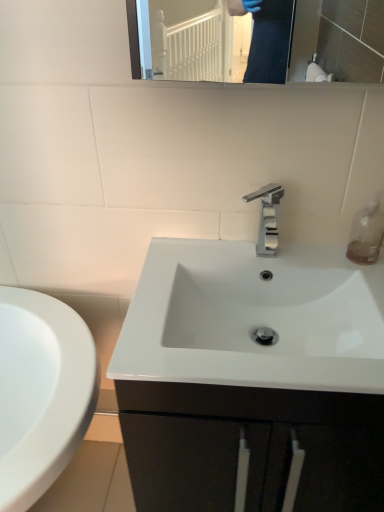
Find the location of a particular element. free space between polished chrome faucet at center and transparent plastic soap dispenser at upper right is located at coordinates (312, 254).